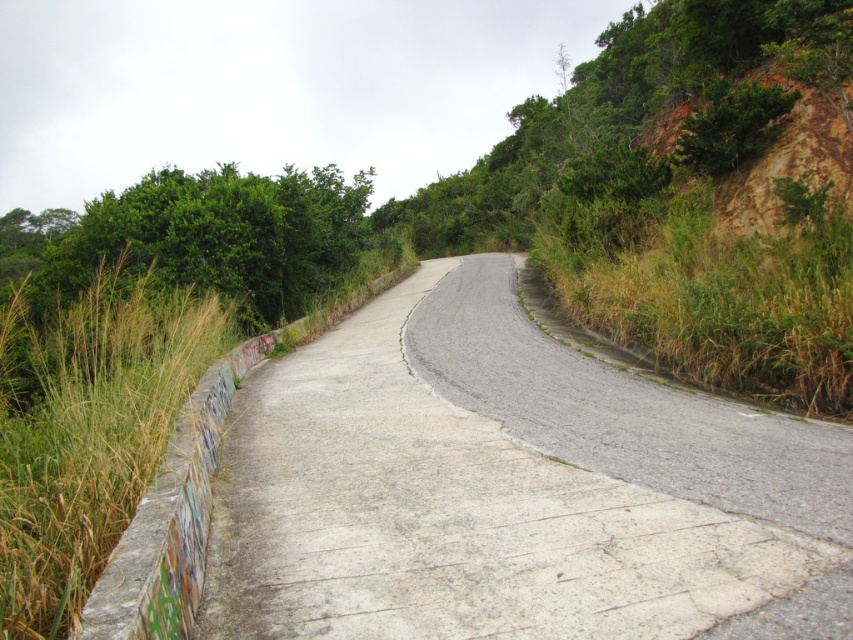
You are a hiker trying to cross the gray concrete road at center to reach the green grass at left. Based on the scene description, which direction should you head to move from the road to the grass?

Result: The gray concrete road at center is located below green grass at left, so you should head upwards from the road to reach the green grass at left.

You are standing at the camera position looking at the winding road. There are two points marked on the road, one at coordinates point (x=141, y=339) and the other at point (x=735, y=385). Which point is nearer to you?

Point (x=141, y=339) is closer to the camera than point (x=735, y=385), so the point at coordinates point (x=141, y=339) is nearer to you.